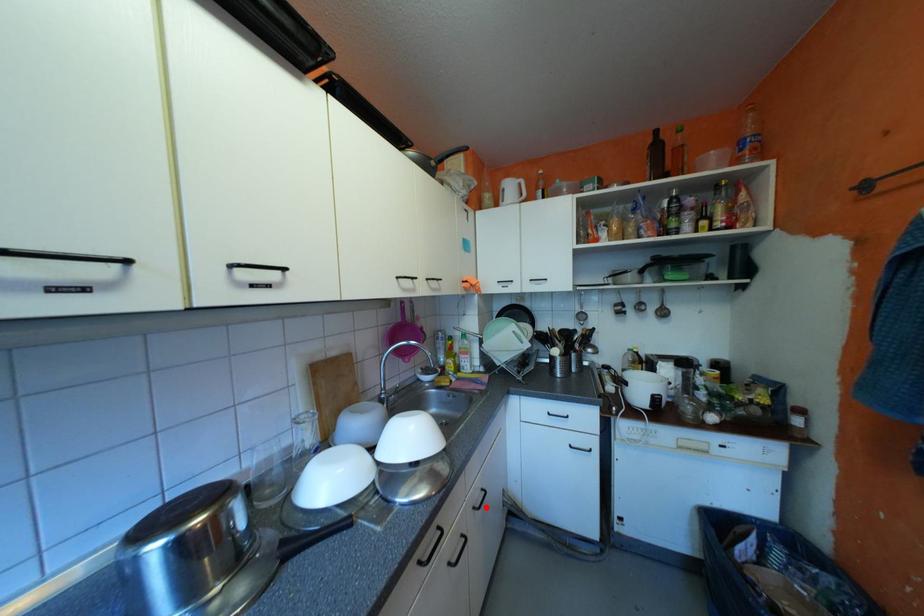
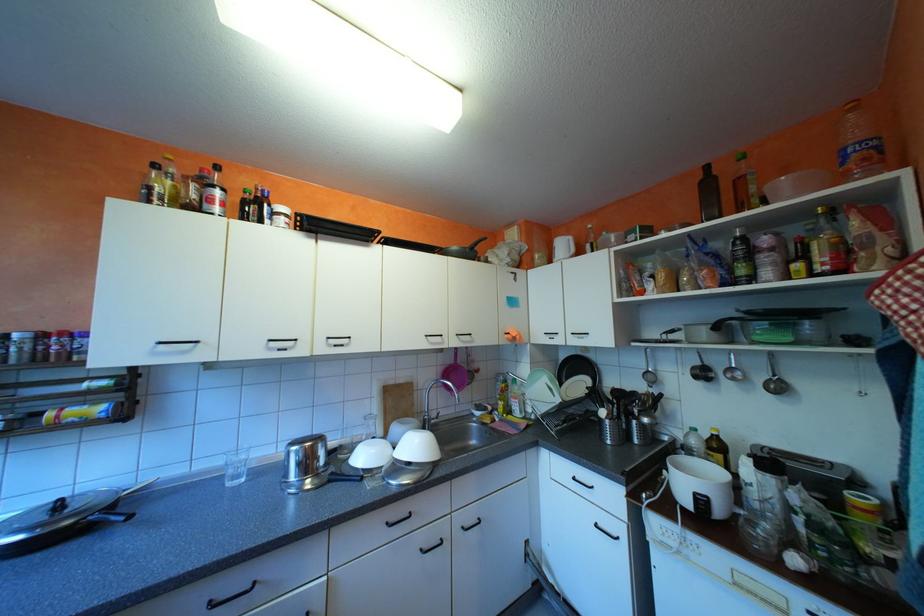
Question: I am providing you with two images of the same scene from different viewpoints. A red point is marked on the first image. At the location where the point appears in image 1, is it still visible in image 2?

Choices:
 (A) Yes
 (B) No

Answer: (A)